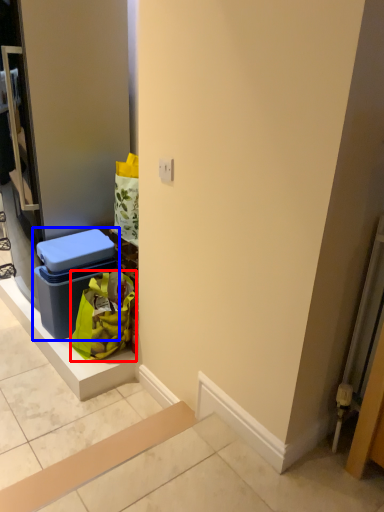
Question: Which point is further to the camera, shopping bag (highlighted by a red box) or storage box (highlighted by a blue box)?

Choices:
 (A) shopping bag
 (B) storage box

Answer: (B)